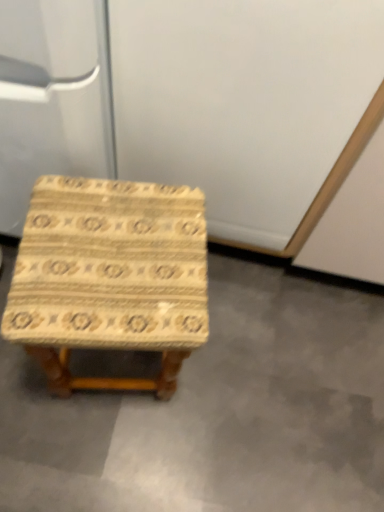
Question: Does wooden-patterned stool at center have a greater width compared to beige textured stool at center?

Choices:
 (A) no
 (B) yes

Answer: (A)

Question: Is wooden-patterned stool at center smaller than beige textured stool at center?

Choices:
 (A) yes
 (B) no

Answer: (B)

Question: Considering the relative sizes of wooden-patterned stool at center and beige textured stool at center in the image provided, is wooden-patterned stool at center shorter than beige textured stool at center?

Choices:
 (A) no
 (B) yes

Answer: (A)

Question: From the image's perspective, is wooden-patterned stool at center above beige textured stool at center?

Choices:
 (A) no
 (B) yes

Answer: (B)

Question: From a real-world perspective, is wooden-patterned stool at center physically above beige textured stool at center?

Choices:
 (A) no
 (B) yes

Answer: (B)

Question: Is wooden-patterned stool at center not near beige textured stool at center?

Choices:
 (A) no
 (B) yes

Answer: (A)

Question: Is beige textured stool at center oriented away from wooden-patterned stool at center?

Choices:
 (A) no
 (B) yes

Answer: (A)

Question: Is beige textured stool at center far from wooden-patterned stool at center?

Choices:
 (A) yes
 (B) no

Answer: (B)

Question: From the image's perspective, is beige textured stool at center located beneath wooden-patterned stool at center?

Choices:
 (A) no
 (B) yes

Answer: (B)

Question: Can you confirm if beige textured stool at center is shorter than wooden-patterned stool at center?

Choices:
 (A) no
 (B) yes

Answer: (B)

Question: Is beige textured stool at center bigger than wooden-patterned stool at center?

Choices:
 (A) no
 (B) yes

Answer: (A)

Question: From a real-world perspective, is beige textured stool at center over wooden-patterned stool at center?

Choices:
 (A) no
 (B) yes

Answer: (A)

Question: Is point (226, 478) closer or farther from the camera than point (148, 305)?

Choices:
 (A) farther
 (B) closer

Answer: (A)